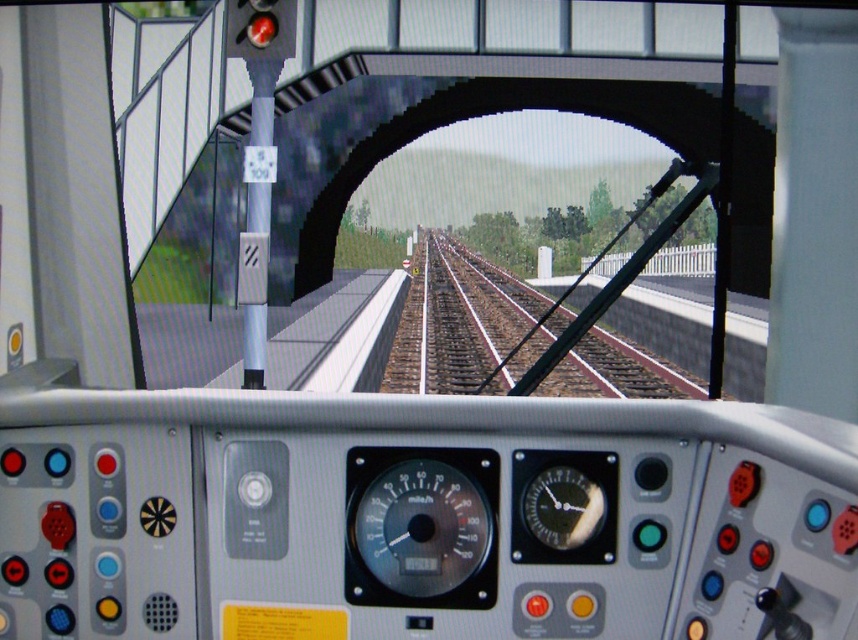
Question: Does matte black gauge at center have a lesser width compared to black glass gauge at center?

Choices:
 (A) yes
 (B) no

Answer: (B)

Question: Considering the real-world distances, which object is closest to the brown gravel train track at center?

Choices:
 (A) matte black gauge at center
 (B) black glass gauge at center

Answer: (A)

Question: Which point is closer to the camera?

Choices:
 (A) black glass gauge at center
 (B) brown gravel train track at center

Answer: (A)

Question: Considering the real-world distances, which object is closest to the matte black gauge at center?

Choices:
 (A) black glass gauge at center
 (B) brown gravel train track at center

Answer: (A)

Question: Is matte black gauge at center smaller than black glass gauge at center?

Choices:
 (A) no
 (B) yes

Answer: (A)

Question: Does matte black gauge at center appear over brown gravel train track at center?

Choices:
 (A) no
 (B) yes

Answer: (A)